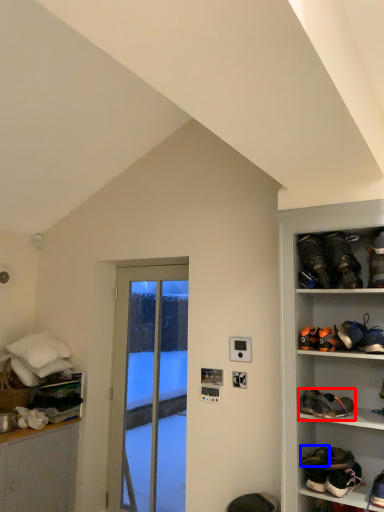
Question: Which point is closer to the camera, footwear (highlighted by a red box) or footwear (highlighted by a blue box)?

Choices:
 (A) footwear
 (B) footwear

Answer: (A)